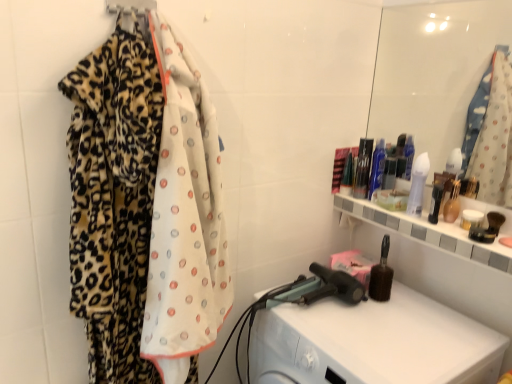
Question: Considering the positions of blue glossy bottle at upper right, arranged as the fifth toiletry when viewed from the right, and translucent glass vase at upper right, the 2th toiletry when ordered from right to left, in the image, is blue glossy bottle at upper right, arranged as the fifth toiletry when viewed from the right, taller or shorter than translucent glass vase at upper right, the 2th toiletry when ordered from right to left,?

Choices:
 (A) short
 (B) tall

Answer: (B)

Question: In terms of width, does blue glossy bottle at upper right, marked as the 4th toiletry in a left-to-right arrangement, look wider or thinner when compared to translucent glass vase at upper right, placed as the seventh toiletry when sorted from left to right?

Choices:
 (A) thin
 (B) wide

Answer: (A)

Question: Estimate the real-world distances between objects in this image. Which object is farther from the blue glossy bottle at upper right, marked as the 4th toiletry in a left-to-right arrangement?

Choices:
 (A) white glossy jar at upper right, acting as the 8th toiletry starting from the left
 (B) leopard print fabric at upper left
 (C) white plastic washing machine at lower right
 (D) white glossy lotion at upper right, the 5th toiletry from the left
 (E) shiny plastic tube at upper right, which ranks as the 2th toiletry in left-to-right order

Answer: (B)

Question: Estimate the real-world distances between objects in this image. Which object is farther from the white glossy jar at upper right, acting as the 8th toiletry starting from the left?

Choices:
 (A) leopard print fabric at upper left
 (B) translucent plastic bottle at right, which is the sixth toiletry in left-to-right order
 (C) green matte brush at upper right, the eighth toiletry when ordered from right to left
 (D) white glossy lotion at upper right, the fourth toiletry from the right
 (E) brown wooden brush at lower right, which is the sixth toiletry from right to left

Answer: (A)